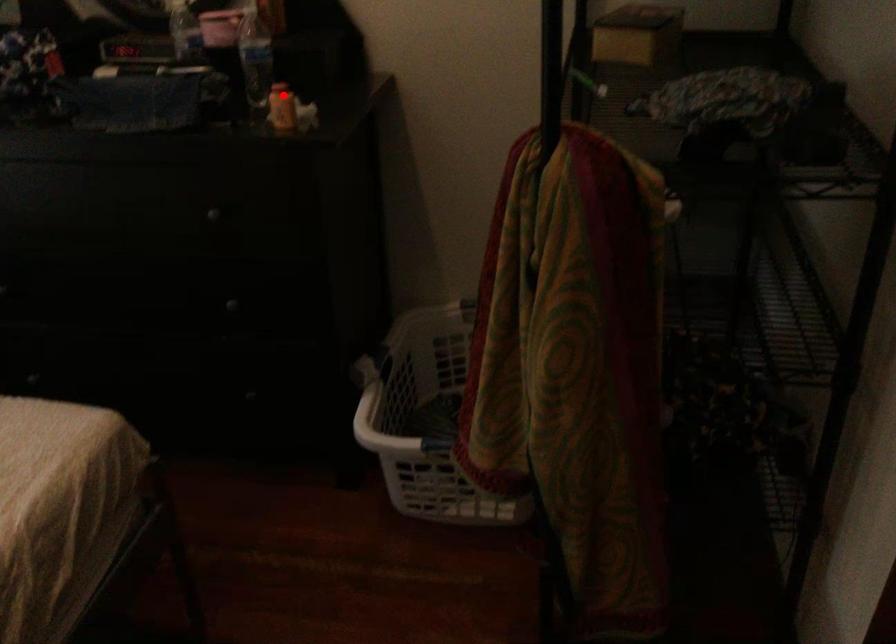
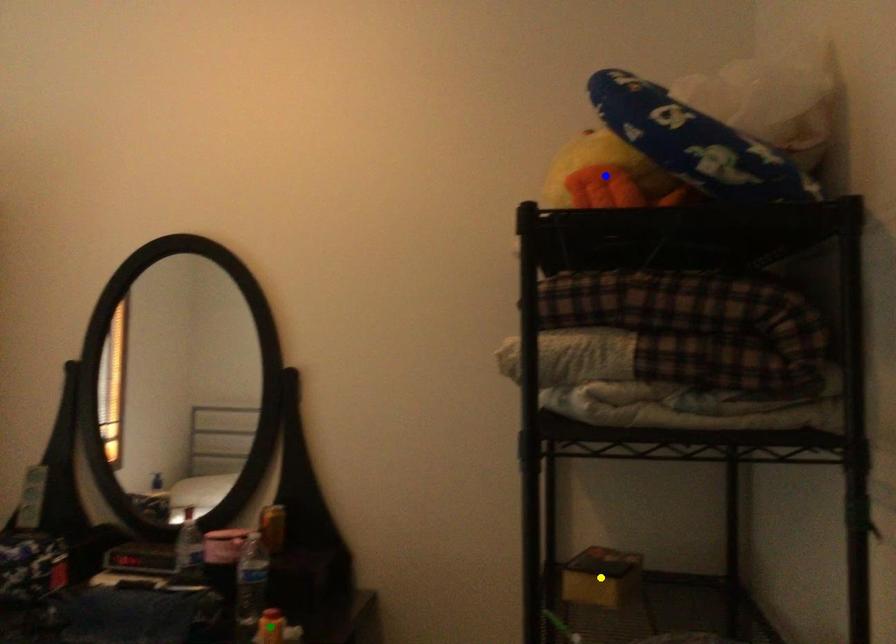
Question: I am providing you with two images of the same scene from different viewpoints. A red point is marked on the first image. You are given multiple points on the second image. Which point in image 2 represents the same 3d spot as the red point in image 1?

Choices:
 (A) yellow point
 (B) blue point
 (C) green point

Answer: (C)